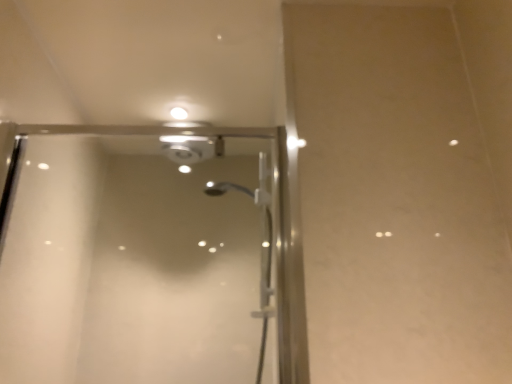
Question: Considering the positions of transparent glass shower door at center and matte white droplight at upper center in the image, is transparent glass shower door at center taller or shorter than matte white droplight at upper center?

Choices:
 (A) short
 (B) tall

Answer: (B)

Question: Looking at their shapes, would you say transparent glass shower door at center is wider or thinner than matte white droplight at upper center?

Choices:
 (A) wide
 (B) thin

Answer: (A)

Question: Would you say transparent glass shower door at center is inside or outside matte white droplight at upper center?

Choices:
 (A) outside
 (B) inside

Answer: (A)

Question: In terms of size, does matte white droplight at upper center appear bigger or smaller than transparent glass shower door at center?

Choices:
 (A) small
 (B) big

Answer: (A)

Question: In terms of width, does matte white droplight at upper center look wider or thinner when compared to transparent glass shower door at center?

Choices:
 (A) wide
 (B) thin

Answer: (B)

Question: Is matte white droplight at upper center in front of or behind transparent glass shower door at center in the image?

Choices:
 (A) behind
 (B) front

Answer: (A)

Question: In the image, is matte white droplight at upper center on the left side or the right side of transparent glass shower door at center?

Choices:
 (A) left
 (B) right

Answer: (A)